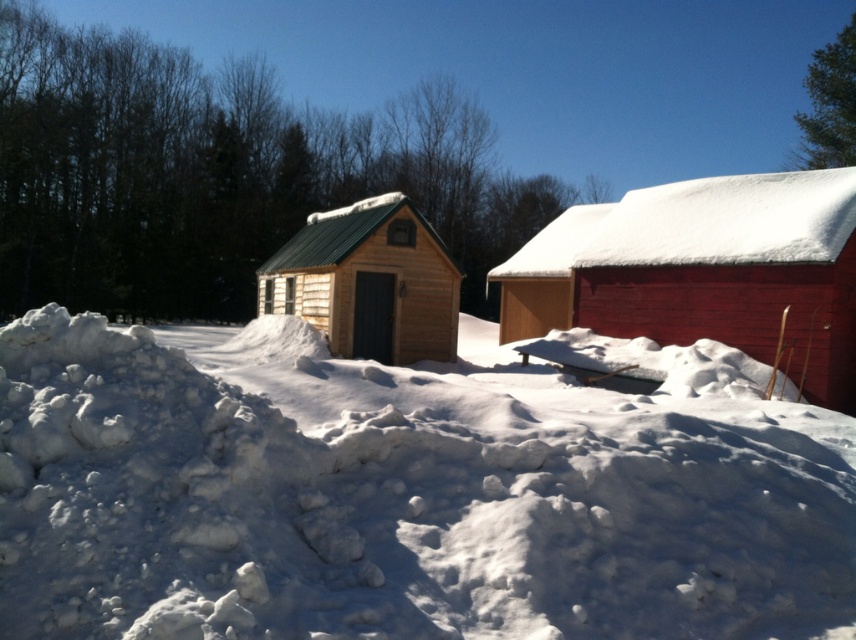
You are an explorer trying to build a snow shelter. You see the white fluffy snow at center and the natural wood cabin at center. Which location would be better for building the shelter based on their positions?

The white fluffy snow at center is located below natural wood cabin at center, so building the shelter there might be safer as it is sheltered from falling snow or debris from the cabin above.